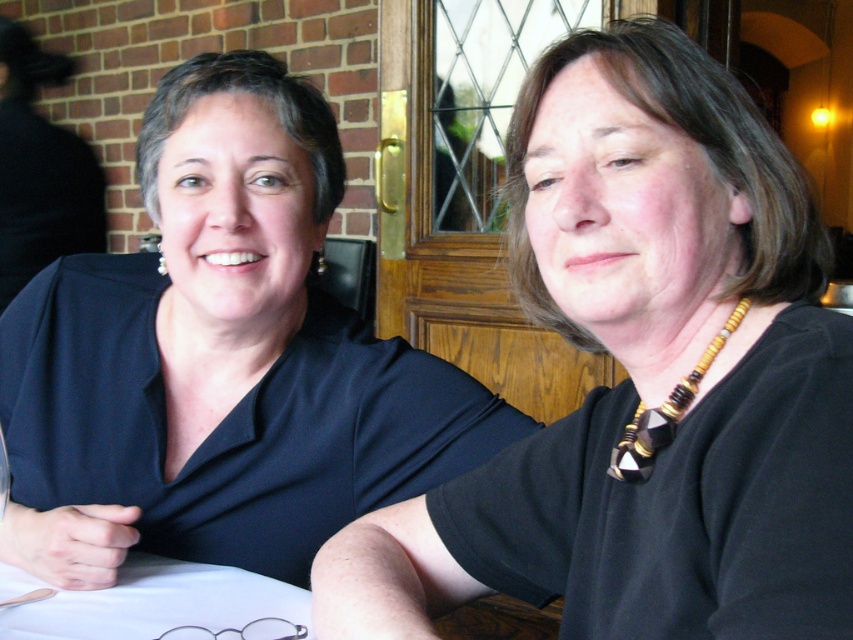
Question: Does black matte necklace at upper center have a lesser width compared to white cloth at lower left?

Choices:
 (A) no
 (B) yes

Answer: (A)

Question: Can you confirm if matte black blouse at left is positioned above white cloth at lower left?

Choices:
 (A) no
 (B) yes

Answer: (B)

Question: Among these objects, which one is nearest to the camera?

Choices:
 (A) black matte necklace at upper center
 (B) white cloth at lower left
 (C) matte black blouse at left

Answer: (A)

Question: Which point is closer to the camera taking this photo?

Choices:
 (A) (258, 188)
 (B) (10, 616)
 (C) (849, 401)

Answer: (C)

Question: Which is farther from the white cloth at lower left?

Choices:
 (A) matte black blouse at left
 (B) black matte necklace at upper center

Answer: (B)

Question: Is black matte necklace at upper center positioned behind matte black blouse at left?

Choices:
 (A) no
 (B) yes

Answer: (A)